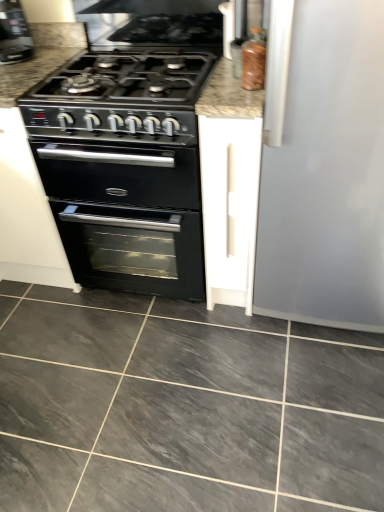
Where is `free point above gray marble floor at center (from a real-world perspective)`? The width and height of the screenshot is (384, 512). free point above gray marble floor at center (from a real-world perspective) is located at coordinates (158, 377).